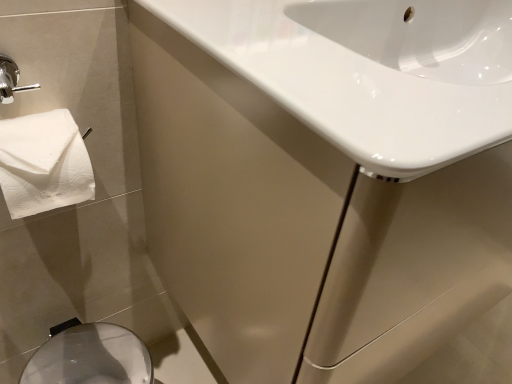
Question: Relative to white glossy sink at upper right, is silver metallic bidet at lower left in front or behind?

Choices:
 (A) front
 (B) behind

Answer: (B)

Question: Is point (148, 382) positioned closer to the camera than point (242, 258)?

Choices:
 (A) farther
 (B) closer

Answer: (A)

Question: Which of these objects is positioned closest to the silver metallic bidet at lower left?

Choices:
 (A) white glossy sink at upper right
 (B) white glossy sink at upper right

Answer: (B)

Question: Which object is positioned farthest from the white glossy sink at upper right?

Choices:
 (A) white glossy sink at upper right
 (B) silver metallic bidet at lower left

Answer: (B)